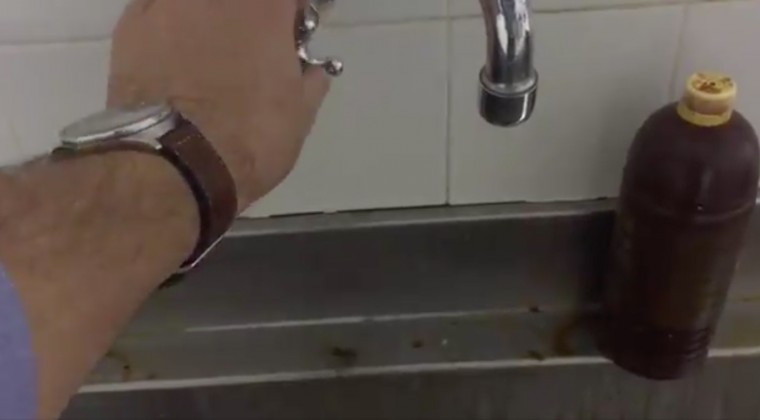
You are a GUI agent. You are given a task and a screenshot of the screen. Output one action in this format:
    pyautogui.click(x=<x>, y=<y>)
    Task: Click on the wall
    The height and width of the screenshot is (420, 760).
    Given the screenshot: What is the action you would take?
    click(x=349, y=149)